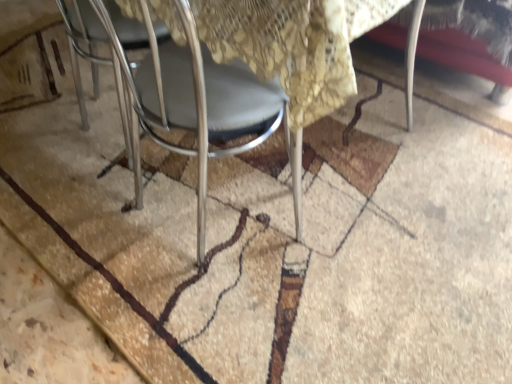
Locate an element on the screen. The width and height of the screenshot is (512, 384). brown textured mat at center is located at coordinates (195, 253).

What do you see at coordinates (195, 253) in the screenshot? I see `brown textured mat at center` at bounding box center [195, 253].

The height and width of the screenshot is (384, 512). What do you see at coordinates (203, 101) in the screenshot?
I see `metallic gray chair at center` at bounding box center [203, 101].

Where is `metallic gray chair at center`? This screenshot has height=384, width=512. metallic gray chair at center is located at coordinates (203, 101).

Identify the location of brown textured mat at center. This screenshot has height=384, width=512. (195, 253).

Between metallic gray chair at center and brown textured mat at center, which one appears on the right side from the viewer's perspective?

Positioned to the right is metallic gray chair at center.

Considering the relative positions of metallic gray chair at center and brown textured mat at center in the image provided, is metallic gray chair at center behind brown textured mat at center?

No, metallic gray chair at center is in front of brown textured mat at center.

Which is closer to the camera, (146, 71) or (86, 349)?

Point (146, 71) is positioned closer to the camera compared to point (86, 349).

From the image's perspective, would you say metallic gray chair at center is shown under brown textured mat at center?

Yes.

From a real-world perspective, is metallic gray chair at center positioned under brown textured mat at center based on gravity?

No, from a real-world perspective, metallic gray chair at center is not under brown textured mat at center.

Between metallic gray chair at center and brown textured mat at center, which one has smaller width?

metallic gray chair at center is thinner.

Can you confirm if metallic gray chair at center is shorter than brown textured mat at center?

No, metallic gray chair at center is not shorter than brown textured mat at center.

Who is bigger, metallic gray chair at center or brown textured mat at center?

brown textured mat at center.

Would you say brown textured mat at center is part of metallic gray chair at center's contents?

No, metallic gray chair at center does not contain brown textured mat at center.

Is metallic gray chair at center in contact with brown textured mat at center?

No, metallic gray chair at center is not next to brown textured mat at center.

Could you tell me if metallic gray chair at center is facing brown textured mat at center?

No, metallic gray chair at center is not aimed at brown textured mat at center.

What's the angular difference between metallic gray chair at center and brown textured mat at center's facing directions?

180 degrees separate the facing orientations of metallic gray chair at center and brown textured mat at center.

How distant is metallic gray chair at center from brown textured mat at center?

13.06 inches.

At what (x,y) coordinates should I click in order to perform the action: click on mat above the metallic gray chair at center (from the image's perspective). Please return your answer as a coordinate pair (x, y). The width and height of the screenshot is (512, 384). Looking at the image, I should click on (195, 253).

Does brown textured mat at center appear on the right side of metallic gray chair at center?

No, brown textured mat at center is not to the right of metallic gray chair at center.

Based on the photo, is brown textured mat at center closer to camera compared to metallic gray chair at center?

No.

Is point (328, 239) behind point (167, 59)?

That is True.

From the image's perspective, is brown textured mat at center on top of metallic gray chair at center?

Yes, from the image's perspective, brown textured mat at center is on top of metallic gray chair at center.

From a real-world perspective, is brown textured mat at center above or below metallic gray chair at center?

From a real-world perspective, brown textured mat at center is physically below metallic gray chair at center.

Considering the sizes of brown textured mat at center and metallic gray chair at center in the image, is brown textured mat at center wider or thinner than metallic gray chair at center?

brown textured mat at center is wider than metallic gray chair at center.

Can you confirm if brown textured mat at center is taller than metallic gray chair at center?

No.

Considering the relative sizes of brown textured mat at center and metallic gray chair at center in the image provided, is brown textured mat at center bigger than metallic gray chair at center?

Correct, brown textured mat at center is larger in size than metallic gray chair at center.

Is brown textured mat at center outside of metallic gray chair at center?

brown textured mat at center lies outside metallic gray chair at center's area.

In the scene shown: Is the surface of brown textured mat at center in direct contact with metallic gray chair at center?

No, brown textured mat at center is not in contact with metallic gray chair at center.

Is brown textured mat at center turned away from metallic gray chair at center?

No, brown textured mat at center is not facing away from metallic gray chair at center.

This screenshot has width=512, height=384. In order to click on chair that is below the brown textured mat at center (from the image's perspective) in this screenshot , I will do `click(203, 101)`.

Locate an element on the screen. The image size is (512, 384). chair that appears above the brown textured mat at center (from a real-world perspective) is located at coordinates (203, 101).

Where is `mat behind the metallic gray chair at center`? Image resolution: width=512 pixels, height=384 pixels. mat behind the metallic gray chair at center is located at coordinates (195, 253).